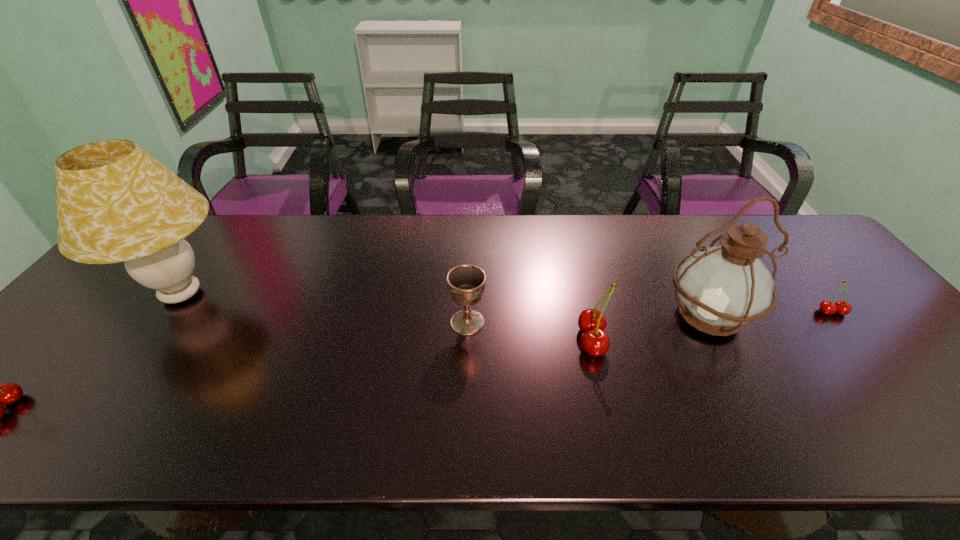
Image resolution: width=960 pixels, height=540 pixels. Identify the location of vacant space situated with the stems of the shortest cherry pointing upwards. (886, 380).

Identify the location of free space located 0.100m on the right of the oil lamp. (791, 316).

This screenshot has height=540, width=960. What are the coordinates of `vacant space located on the front of the chalice` in the screenshot? It's located at (466, 377).

The image size is (960, 540). In order to click on vacant region located on the right of the lampshade in this screenshot , I will do `click(341, 295)`.

Where is `object that is positioned at the far edge`? This screenshot has width=960, height=540. object that is positioned at the far edge is located at coordinates (115, 202).

Where is `object at the left edge`? object at the left edge is located at coordinates (115, 202).

This screenshot has width=960, height=540. I want to click on object that is at the right edge, so click(x=826, y=307).

You are a GUI agent. You are given a task and a screenshot of the screen. Output one action in this format:
    pyautogui.click(x=<x>, y=<y>)
    Task: Click on the object situated at the far left corner
    This screenshot has height=540, width=960.
    Given the screenshot: What is the action you would take?
    click(115, 202)

Identify the location of vacant space at the far edge. (708, 227).

You are a GUI agent. You are given a task and a screenshot of the screen. Output one action in this format:
    pyautogui.click(x=<x>, y=<y>)
    Task: Click on the vacant space at the left edge
    This screenshot has width=960, height=540.
    Given the screenshot: What is the action you would take?
    pyautogui.click(x=67, y=342)